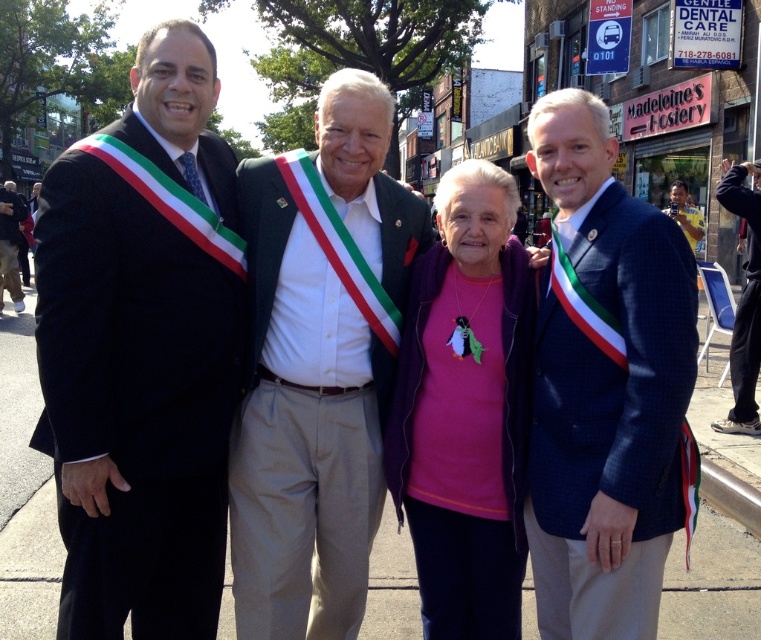
Question: Among these points, which one is nearest to the camera?

Choices:
 (A) (72, 486)
 (B) (276, 348)

Answer: (A)

Question: Is white cotton shirt at center above blue textured blazer at center?

Choices:
 (A) no
 (B) yes

Answer: (B)

Question: Can you confirm if white cotton shirt at center is bigger than blue textured blazer at center?

Choices:
 (A) yes
 (B) no

Answer: (A)

Question: Which object is the farthest from the matte black suit at left?

Choices:
 (A) white cotton shirt at center
 (B) purple fabric at center

Answer: (B)

Question: Considering the real-world distances, which object is closest to the black fabric pants at lower right?

Choices:
 (A) purple fabric at center
 (B) white cotton shirt at center

Answer: (A)

Question: Does white cotton shirt at center appear over blue textured blazer at center?

Choices:
 (A) yes
 (B) no

Answer: (A)